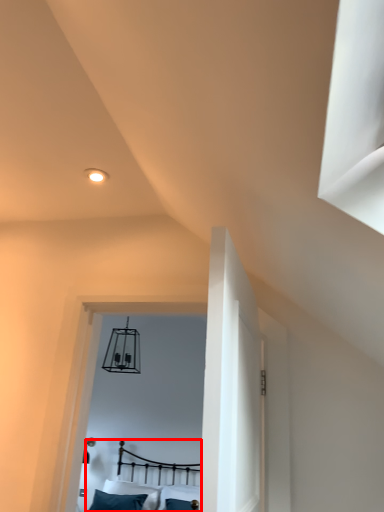
Question: From the image's perspective, considering the relative positions of bed (annotated by the red box) and pillow in the image provided, where is bed (annotated by the red box) located with respect to the staircase?

Choices:
 (A) above
 (B) below

Answer: (A)